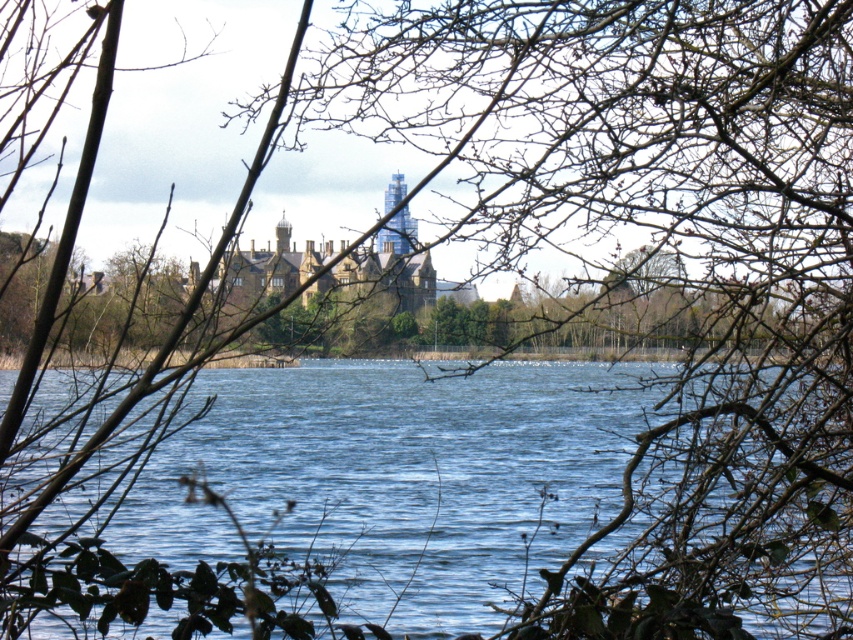
You are standing at the lakeside and notice the brown leafless branches at center and the blue water at center. From your perspective, which object is positioned to the right side?

The brown leafless branches at center are to the right of the blue water at center.

You are standing at the lakeside and want to take a photo of the blue water at center without the brown leafless branches at center blocking the view. Is it possible to move your position so that the branches are no longer in front of the water?

The brown leafless branches at center are closer to the viewer than the blue water at center, so moving your position might not help because the branches will still be in front of the water unless you move around them.

Based on the scene description, what object is located at the coordinates point (664, 266)?

The brown leafless branches at center are located at point (664, 266).